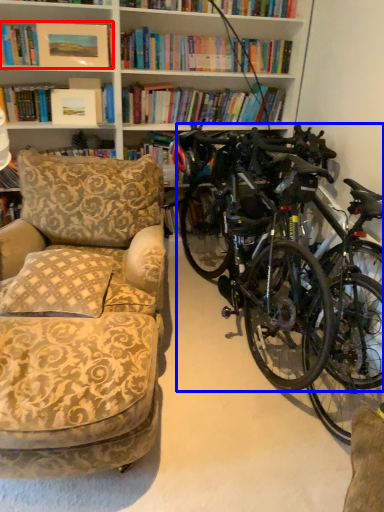
Question: Which object appears farthest to the camera in this image, book (highlighted by a red box) or bicycle (highlighted by a blue box)?

Choices:
 (A) book
 (B) bicycle

Answer: (A)